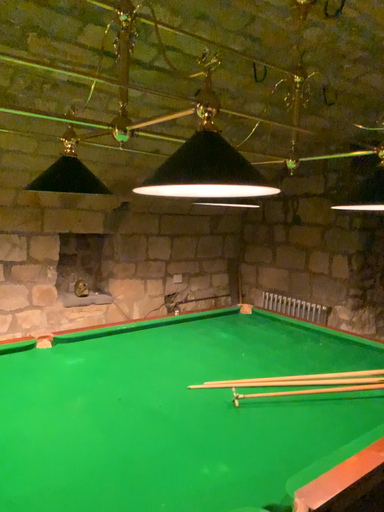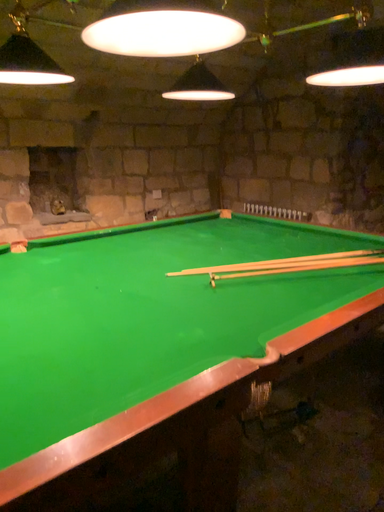
Question: Which way did the camera rotate in the video?

Choices:
 (A) rotated upward
 (B) rotated downward

Answer: (B)